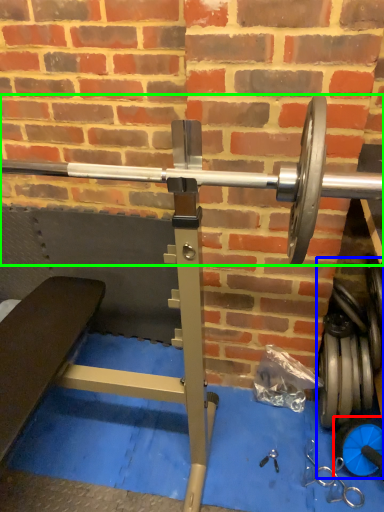
Question: Which object is positioned farthest from dumbbell (highlighted by a red box)? Select from dumbbell (highlighted by a blue box) and barbell (highlighted by a green box).

Choices:
 (A) dumbbell
 (B) barbell

Answer: (B)